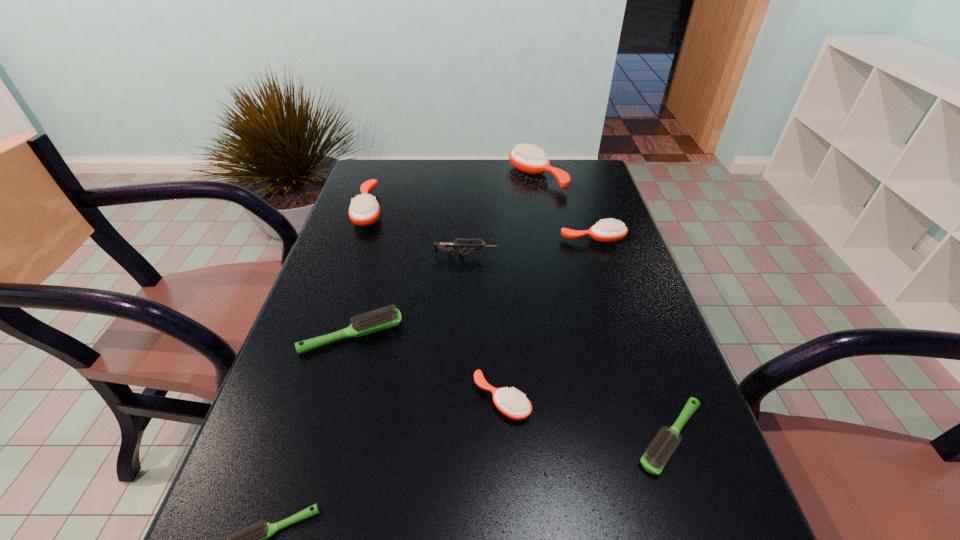
Find the location of a particular element. the nearest orange hairbrush is located at coordinates (510, 402).

What are the coordinates of `the rightmost light hairbrush` in the screenshot? It's located at (655, 458).

Image resolution: width=960 pixels, height=540 pixels. Identify the location of the second nearest light hairbrush. (655, 458).

This screenshot has width=960, height=540. I want to click on vacant space situated on the right of the tallest hairbrush, so click(x=592, y=177).

Where is `free point located on the back of the sixth shortest hairbrush`? This screenshot has width=960, height=540. free point located on the back of the sixth shortest hairbrush is located at coordinates (385, 163).

The height and width of the screenshot is (540, 960). I want to click on free location located 0.200m aimed along the barrel of the grey gun, so click(576, 255).

The width and height of the screenshot is (960, 540). In order to click on vacant space located 0.110m on the left of the third tallest hairbrush in this screenshot , I will do `click(520, 239)`.

The image size is (960, 540). Find the location of `vacant point located on the right of the fourth farthest hairbrush`. vacant point located on the right of the fourth farthest hairbrush is located at coordinates (461, 335).

The width and height of the screenshot is (960, 540). Find the location of `vacant space located 0.090m on the front of the third orange hairbrush from right to left`. vacant space located 0.090m on the front of the third orange hairbrush from right to left is located at coordinates (505, 474).

Where is `free region located 0.200m on the back of the rightmost light hairbrush`? free region located 0.200m on the back of the rightmost light hairbrush is located at coordinates (632, 323).